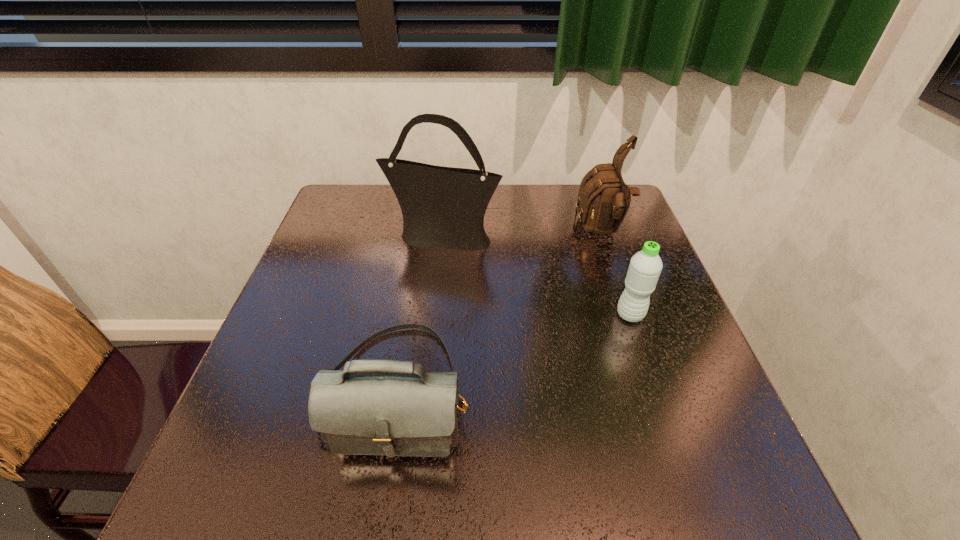
The width and height of the screenshot is (960, 540). Find the location of `the tallest shoulder bag`. the tallest shoulder bag is located at coordinates (442, 207).

The image size is (960, 540). I want to click on the second shortest shoulder bag, so click(603, 200).

At what (x,y) coordinates should I click in order to perform the action: click on the second tallest object. Please return your answer as a coordinate pair (x, y). The width and height of the screenshot is (960, 540). Looking at the image, I should click on (603, 200).

Locate an element on the screen. water bottle is located at coordinates (645, 267).

I want to click on the shortest shoulder bag, so click(x=373, y=407).

You are a GUI agent. You are given a task and a screenshot of the screen. Output one action in this format:
    pyautogui.click(x=<x>, y=<y>)
    Task: Click on the nearest object
    Image resolution: width=960 pixels, height=540 pixels.
    Given the screenshot: What is the action you would take?
    pyautogui.click(x=373, y=407)

This screenshot has width=960, height=540. In order to click on vacant region located on the front of the tallest object in this screenshot , I will do `click(435, 305)`.

I want to click on vacant area located 0.100m on the front-facing side of the third shortest object, so click(540, 232).

The image size is (960, 540). What are the coordinates of `free space located 0.320m on the front-facing side of the third shortest object` in the screenshot? It's located at (461, 232).

This screenshot has height=540, width=960. I want to click on vacant space located on the front-facing side of the third shortest object, so click(x=493, y=232).